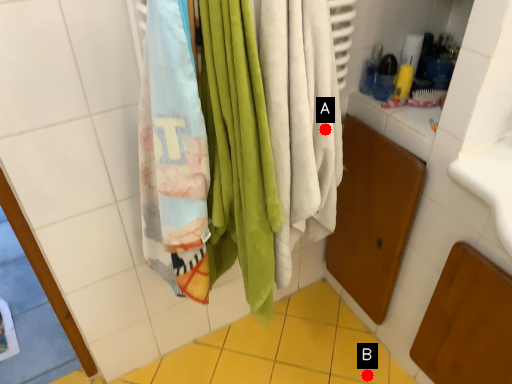
Question: Two points are circled on the image, labeled by A and B beside each circle. Which point appears farthest from the camera in this image?

Choices:
 (A) A is further
 (B) B is further

Answer: (B)